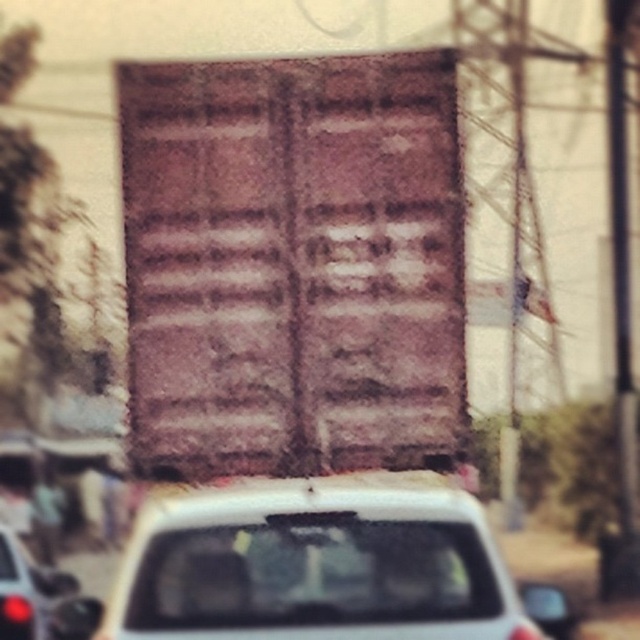
Based on the scene description, where is the white matte car at center located in terms of coordinates?

The white matte car at center is located at coordinates point (321,564).

Looking at this image, you are a pedestrian standing at the edge of the road and see the white matte car at center and the metallic silver car at lower left. Which car is closer to you?

The white matte car at center is closer to you because it is in front of the metallic silver car at lower left, indicating it is nearer in the scene.